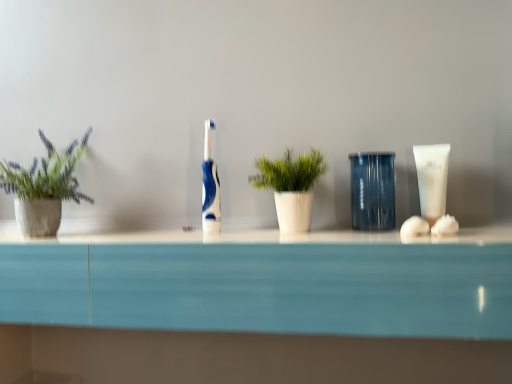
This screenshot has height=384, width=512. Describe the element at coordinates (44, 187) in the screenshot. I see `green leafy plant in concrete pot at left, the first houseplant viewed from the left` at that location.

Locate an element on the screen. green glossy plant at center, arranged as the 2th houseplant when viewed from the left is located at coordinates (290, 187).

Relative to transparent plastic cup at center, is green leafy plant in concrete pot at left, positioned as the 2th houseplant in right-to-left order, in front or behind?

green leafy plant in concrete pot at left, positioned as the 2th houseplant in right-to-left order, is positioned closer to the viewer than transparent plastic cup at center.

Is green leafy plant in concrete pot at left, positioned as the 2th houseplant in right-to-left order, oriented away from transparent plastic cup at center?

No, green leafy plant in concrete pot at left, positioned as the 2th houseplant in right-to-left order,'s orientation is not away from transparent plastic cup at center.

Considering the sizes of objects green leafy plant in concrete pot at left, the first houseplant viewed from the left, and transparent plastic cup at center in the image provided, who is taller, green leafy plant in concrete pot at left, the first houseplant viewed from the left, or transparent plastic cup at center?

green leafy plant in concrete pot at left, the first houseplant viewed from the left.

How much distance is there between green leafy plant in concrete pot at left, the first houseplant viewed from the left, and transparent plastic cup at center?

green leafy plant in concrete pot at left, the first houseplant viewed from the left, and transparent plastic cup at center are 23.35 inches apart.

Identify the location of toothbrush behind the white matte tube at right. (210, 188).

From a real-world perspective, who is located higher, white matte tube at right or blue glossy toothbrush at center?

blue glossy toothbrush at center.

In the scene shown: Can we say white matte tube at right lies outside blue glossy toothbrush at center?

Indeed, white matte tube at right is completely outside blue glossy toothbrush at center.

Identify the location of houseplant in front of the green leafy plant in concrete pot at left, the first houseplant viewed from the left. pos(290,187).

Does point (277, 168) come farther from viewer compared to point (56, 193)?

No, it is not.

Is green glossy plant at center, acting as the first houseplant starting from the right, facing away from green leafy plant in concrete pot at left, the first houseplant viewed from the left?

green glossy plant at center, acting as the first houseplant starting from the right, is not turned away from green leafy plant in concrete pot at left, the first houseplant viewed from the left.

Does green glossy plant at center, acting as the first houseplant starting from the right, touch green leafy plant in concrete pot at left, the first houseplant viewed from the left?

No.

Between transparent plastic cup at center and green leafy plant in concrete pot at left, the first houseplant viewed from the left, which one has more height?

With more height is green leafy plant in concrete pot at left, the first houseplant viewed from the left.

Is transparent plastic cup at center wider than green leafy plant in concrete pot at left, the first houseplant viewed from the left?

Incorrect, the width of transparent plastic cup at center does not surpass that of green leafy plant in concrete pot at left, the first houseplant viewed from the left.

Is transparent plastic cup at center oriented towards green leafy plant in concrete pot at left, positioned as the 2th houseplant in right-to-left order?

No.

Would you say transparent plastic cup at center is outside green leafy plant in concrete pot at left, the first houseplant viewed from the left?

transparent plastic cup at center lies outside green leafy plant in concrete pot at left, the first houseplant viewed from the left,'s area.

Is point (417, 164) closer or farther from the camera than point (359, 158)?

Point (417, 164) appears to be farther away from the viewer than point (359, 158).

From the image's perspective, is white matte tube at right under transparent plastic cup at center?

No, from the image's perspective, white matte tube at right is not below transparent plastic cup at center.

Based on the photo, which object is thinner, white matte tube at right or transparent plastic cup at center?

white matte tube at right.

Considering the sizes of objects blue glossy toothbrush at center and green glossy plant at center, arranged as the 2th houseplant when viewed from the left, in the image provided, who is taller, blue glossy toothbrush at center or green glossy plant at center, arranged as the 2th houseplant when viewed from the left,?

blue glossy toothbrush at center is taller.

From the image's perspective, between blue glossy toothbrush at center and green glossy plant at center, acting as the first houseplant starting from the right, who is located below?

green glossy plant at center, acting as the first houseplant starting from the right, is shown below in the image.

Which object is positioned more to the right, blue glossy toothbrush at center or green glossy plant at center, arranged as the 2th houseplant when viewed from the left?

From the viewer's perspective, green glossy plant at center, arranged as the 2th houseplant when viewed from the left, appears more on the right side.

How distant is green leafy plant in concrete pot at left, positioned as the 2th houseplant in right-to-left order, from white matte tube at right?

They are 27.74 inches apart.

Considering the sizes of objects green leafy plant in concrete pot at left, positioned as the 2th houseplant in right-to-left order, and white matte tube at right in the image provided, who is bigger, green leafy plant in concrete pot at left, positioned as the 2th houseplant in right-to-left order, or white matte tube at right?

With larger size is green leafy plant in concrete pot at left, positioned as the 2th houseplant in right-to-left order.

From a real-world perspective, who is located lower, green leafy plant in concrete pot at left, the first houseplant viewed from the left, or white matte tube at right?

white matte tube at right, from a real-world perspective.

Which is farther, (x=60, y=193) or (x=437, y=186)?

The point (x=60, y=193) is farther from the camera.

This screenshot has width=512, height=384. In order to click on glass vase behind the green leafy plant in concrete pot at left, the first houseplant viewed from the left in this screenshot , I will do `click(372, 190)`.

This screenshot has height=384, width=512. Identify the location of toiletry located on the right of blue glossy toothbrush at center. (432, 179).

Which object lies further to the anchor point green glossy plant at center, arranged as the 2th houseplant when viewed from the left, white matte tube at right or blue glossy toothbrush at center?

Among the two, white matte tube at right is located further to green glossy plant at center, arranged as the 2th houseplant when viewed from the left.

Looking at the image, which one is located further to blue glossy toothbrush at center, green leafy plant in concrete pot at left, positioned as the 2th houseplant in right-to-left order, or transparent plastic cup at center?

green leafy plant in concrete pot at left, positioned as the 2th houseplant in right-to-left order.

When comparing their distances from blue glossy toothbrush at center, does green glossy plant at center, arranged as the 2th houseplant when viewed from the left, or white matte tube at right seem closer?

Based on the image, green glossy plant at center, arranged as the 2th houseplant when viewed from the left, appears to be nearer to blue glossy toothbrush at center.

From the image, which object appears to be farther from white matte tube at right, green glossy plant at center, arranged as the 2th houseplant when viewed from the left, or transparent plastic cup at center?

green glossy plant at center, arranged as the 2th houseplant when viewed from the left, is positioned further to the anchor white matte tube at right.

Considering their positions, is green leafy plant in concrete pot at left, the first houseplant viewed from the left, positioned closer to blue glossy toothbrush at center than green glossy plant at center, acting as the first houseplant starting from the right?

green glossy plant at center, acting as the first houseplant starting from the right, lies closer to blue glossy toothbrush at center than the other object.

Considering their positions, is green leafy plant in concrete pot at left, the first houseplant viewed from the left, positioned closer to white matte tube at right than transparent plastic cup at center?

transparent plastic cup at center is closer to white matte tube at right.

Estimate the real-world distances between objects in this image. Which object is closer to transparent plastic cup at center, blue glossy toothbrush at center or white matte tube at right?

Based on the image, white matte tube at right appears to be nearer to transparent plastic cup at center.

Based on the photo, considering their positions, is green leafy plant in concrete pot at left, positioned as the 2th houseplant in right-to-left order, positioned further to transparent plastic cup at center than blue glossy toothbrush at center?

Among the two, green leafy plant in concrete pot at left, positioned as the 2th houseplant in right-to-left order, is located further to transparent plastic cup at center.

At what (x,y) coordinates should I click in order to perform the action: click on glass vase situated between green glossy plant at center, acting as the first houseplant starting from the right, and white matte tube at right from left to right. Please return your answer as a coordinate pair (x, y). This screenshot has width=512, height=384. Looking at the image, I should click on (372, 190).

This screenshot has height=384, width=512. Find the location of `houseplant between blue glossy toothbrush at center and transparent plastic cup at center`. houseplant between blue glossy toothbrush at center and transparent plastic cup at center is located at coordinates (290, 187).

The image size is (512, 384). In order to click on toothbrush between green leafy plant in concrete pot at left, positioned as the 2th houseplant in right-to-left order, and transparent plastic cup at center, in the horizontal direction in this screenshot , I will do `click(210, 188)`.

This screenshot has height=384, width=512. In order to click on toothbrush between green leafy plant in concrete pot at left, positioned as the 2th houseplant in right-to-left order, and green glossy plant at center, arranged as the 2th houseplant when viewed from the left, from left to right in this screenshot , I will do `click(210, 188)`.